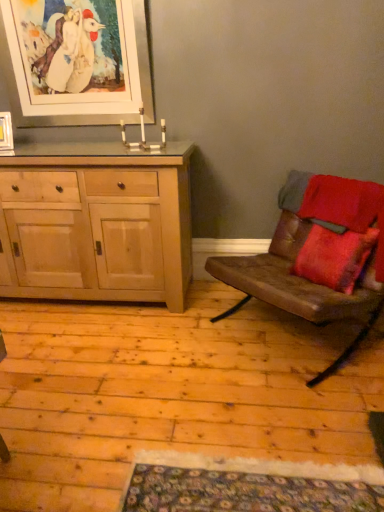
Question: Is white matte picture frame at upper left, marked as the second picture frame in a left-to-right arrangement, inside matte wooden picture frame at upper left, positioned as the first picture frame in bottom-to-top order?

Choices:
 (A) yes
 (B) no

Answer: (B)

Question: From the image's perspective, would you say matte wooden picture frame at upper left, the 2th picture frame positioned from the right, is positioned over white matte picture frame at upper left, which ranks as the 1th picture frame in top-to-bottom order?

Choices:
 (A) no
 (B) yes

Answer: (A)

Question: Is matte wooden picture frame at upper left, positioned as the 2th picture frame in top-to-bottom order, taller than white matte picture frame at upper left, which ranks as the 1th picture frame in top-to-bottom order?

Choices:
 (A) no
 (B) yes

Answer: (A)

Question: From the image's perspective, does matte wooden picture frame at upper left, the 2th picture frame positioned from the right, appear lower than white matte picture frame at upper left, marked as the second picture frame in a left-to-right arrangement?

Choices:
 (A) no
 (B) yes

Answer: (B)

Question: Does matte wooden picture frame at upper left, positioned as the 2th picture frame in top-to-bottom order, have a smaller size compared to white matte picture frame at upper left, marked as the second picture frame in a left-to-right arrangement?

Choices:
 (A) no
 (B) yes

Answer: (B)

Question: From a real-world perspective, is matte wooden picture frame at upper left, the 2th picture frame positioned from the right, positioned over white matte picture frame at upper left, marked as the second picture frame in a left-to-right arrangement, based on gravity?

Choices:
 (A) yes
 (B) no

Answer: (B)

Question: From the image's perspective, is white matte picture frame at upper left, which appears as the 1th picture frame when viewed from the right, above matte wooden picture frame at upper left, positioned as the first picture frame in bottom-to-top order?

Choices:
 (A) no
 (B) yes

Answer: (B)

Question: Can you confirm if white matte picture frame at upper left, which appears as the 1th picture frame when viewed from the right, is shorter than matte wooden picture frame at upper left, the 2th picture frame positioned from the right?

Choices:
 (A) yes
 (B) no

Answer: (B)

Question: Is white matte picture frame at upper left, which appears as the 1th picture frame when viewed from the right, positioned behind matte wooden picture frame at upper left, positioned as the first picture frame in bottom-to-top order?

Choices:
 (A) yes
 (B) no

Answer: (B)

Question: Is matte wooden picture frame at upper left, acting as the 1th picture frame starting from the left, completely or partially inside white matte picture frame at upper left, marked as the second picture frame in a left-to-right arrangement?

Choices:
 (A) yes
 (B) no

Answer: (B)

Question: From a real-world perspective, does white matte picture frame at upper left, which appears as the 1th picture frame when viewed from the right, stand above matte wooden picture frame at upper left, positioned as the 2th picture frame in top-to-bottom order?

Choices:
 (A) yes
 (B) no

Answer: (A)

Question: Is matte wooden picture frame at upper left, the 2th picture frame positioned from the right, at the back of white matte picture frame at upper left, positioned as the second picture frame in bottom-to-top order?

Choices:
 (A) yes
 (B) no

Answer: (B)

Question: Is brown leather couch at right thinner than white matte picture frame at upper left, which appears as the 1th picture frame when viewed from the right?

Choices:
 (A) no
 (B) yes

Answer: (A)